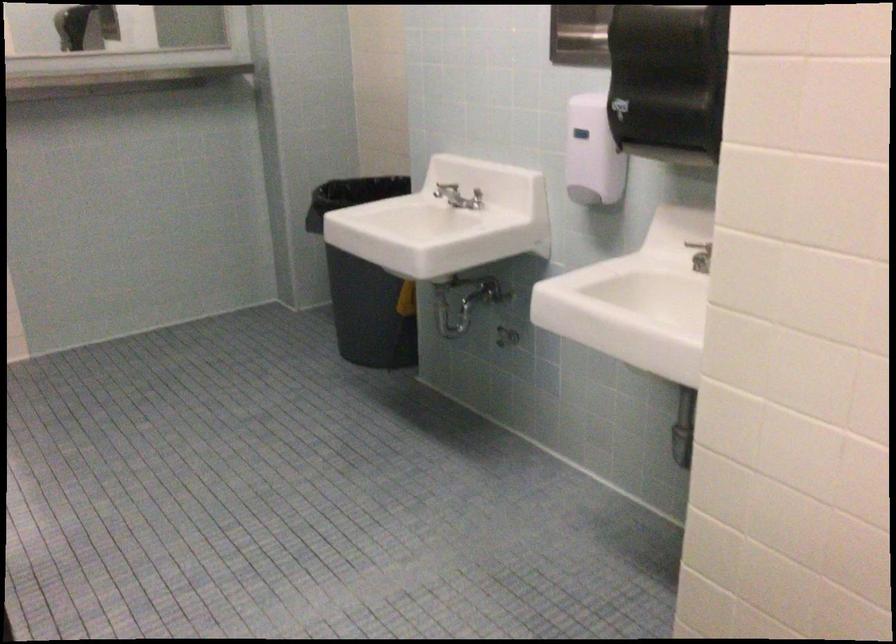
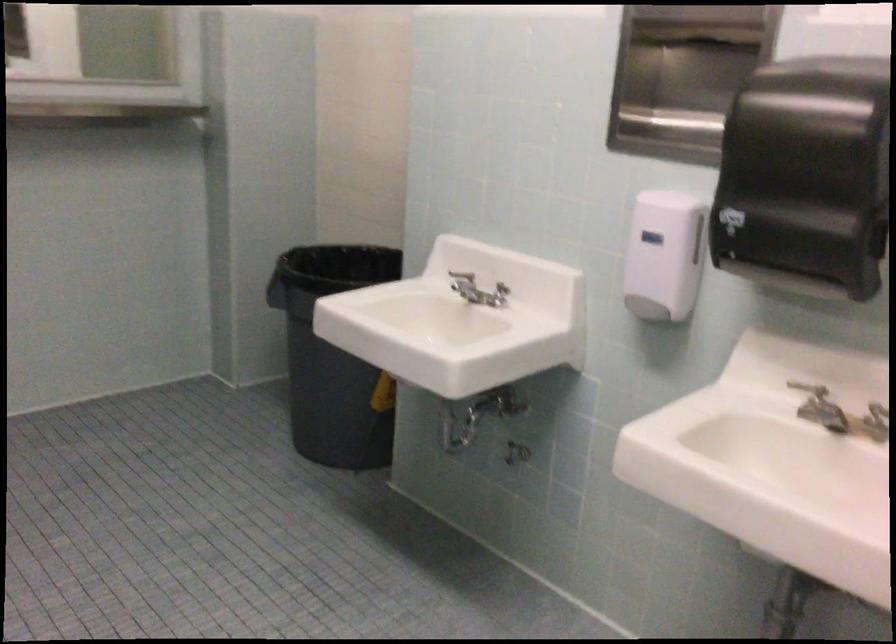
In a continuous first-person perspective shot, in which direction is the camera moving?

The cameraman walked toward left, forward.